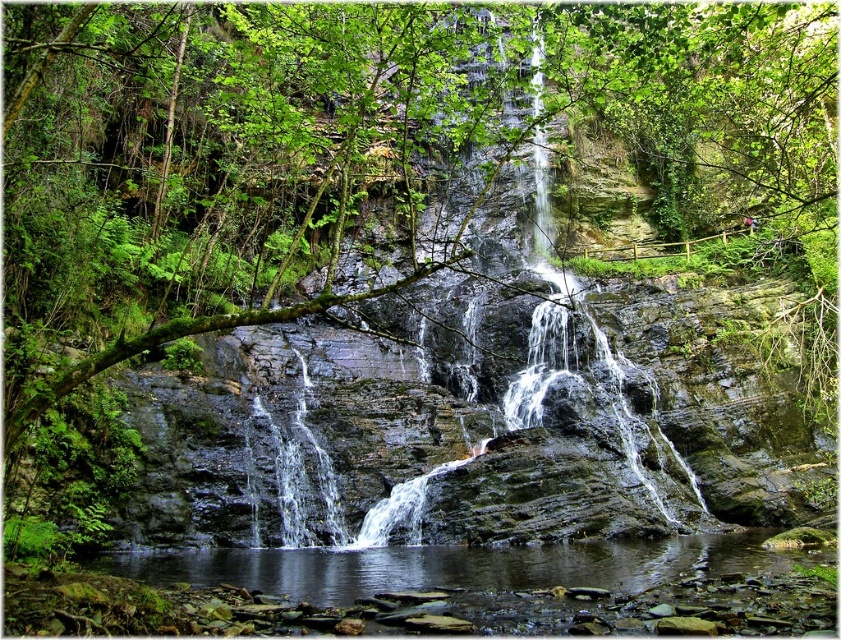
Is smooth rock waterfall at center smaller than clear water at bottom?

Actually, smooth rock waterfall at center might be larger than clear water at bottom.

From the picture: Is smooth rock waterfall at center bigger than clear water at bottom?

Yes.

Does point (268, 404) come closer to viewer compared to point (821, 554)?

No, (268, 404) is behind (821, 554).

Locate an element on the screen. This screenshot has height=640, width=841. smooth rock waterfall at center is located at coordinates (459, 401).